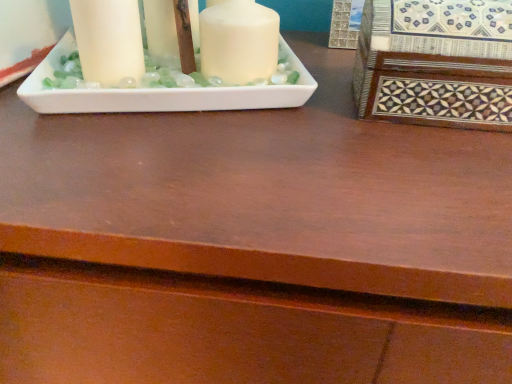
Locate an element on the screen. The image size is (512, 384). free space in front of inlaid wood box at right is located at coordinates (417, 187).